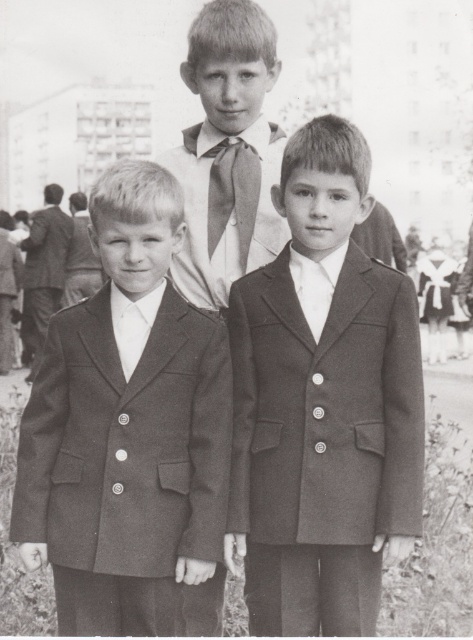
Is point (238, 445) more distant than point (452, 280)?

No, (238, 445) is closer to viewer.

Is matte black suit at center to the left of matte white dress at center from the viewer's perspective?

Yes, matte black suit at center is to the left of matte white dress at center.

Does point (294, 330) come behind point (441, 284)?

No, (294, 330) is in front of (441, 284).

Find the location of a particular element. matte black suit at center is located at coordinates pos(323,404).

The width and height of the screenshot is (473, 640). What do you see at coordinates (43, 273) in the screenshot? I see `smooth fabric suit at left` at bounding box center [43, 273].

Image resolution: width=473 pixels, height=640 pixels. Identify the location of smooth fabric suit at left. (43, 273).

Who is more distant from viewer, (40, 324) or (438, 294)?

Point (438, 294)

Identify the location of smooth fabric suit at left. (43, 273).

Does smooth fabric suit at center have a greater width compared to silky light gray tie at center?

Correct, the width of smooth fabric suit at center exceeds that of silky light gray tie at center.

Is smooth fabric suit at center thinner than silky light gray tie at center?

No, smooth fabric suit at center is not thinner than silky light gray tie at center.

Is point (121, 317) positioned before point (219, 172)?

Yes, it is.

This screenshot has width=473, height=640. I want to click on smooth fabric suit at center, so click(x=129, y=433).